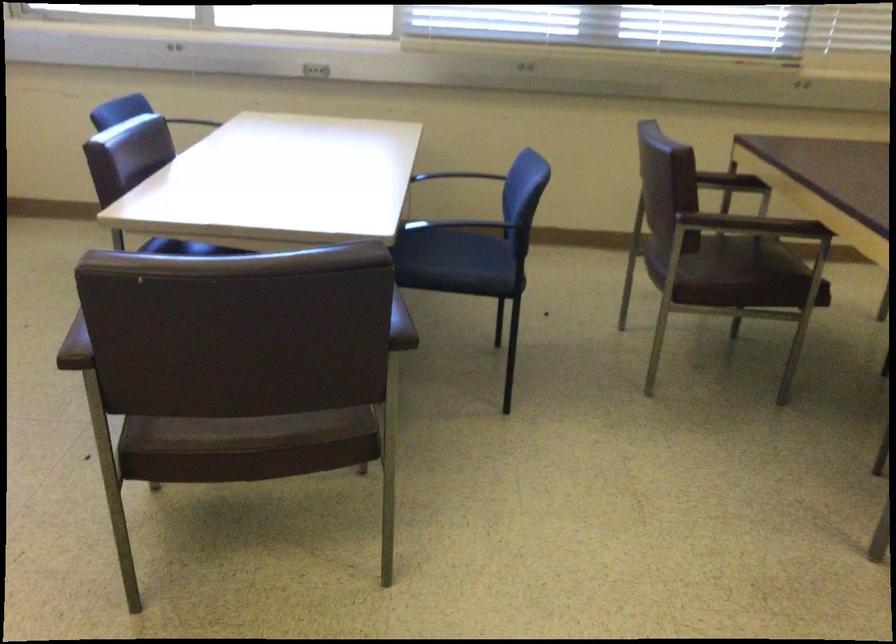
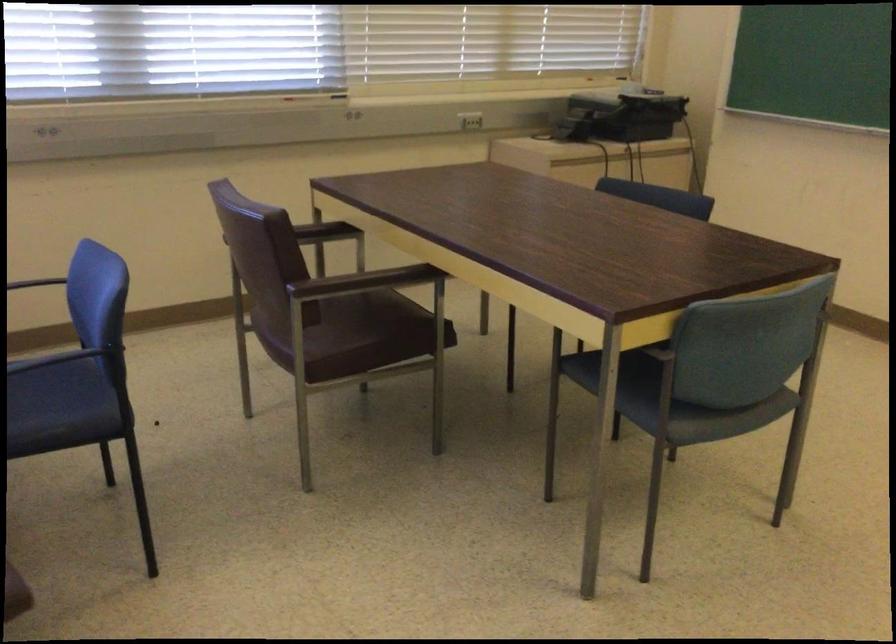
Find the pixel in the second image that matches the point at 493,185 in the first image.

(39, 283)